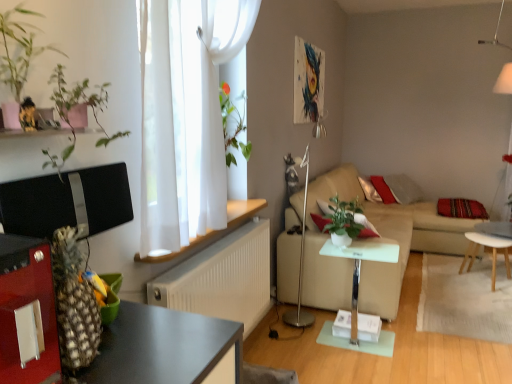
Question: Should I look upward or downward to see light wood/wooden stool at lower right, the second table when ordered from front to back?

Choices:
 (A) down
 (B) up

Answer: (A)

Question: Are white textured radiator at center and silver metallic floor lamp at center, positioned as the 1th lamp in left-to-right order, beside each other?

Choices:
 (A) no
 (B) yes

Answer: (A)

Question: Is white textured radiator at center positioned in front of silver metallic floor lamp at center, positioned as the 1th lamp in left-to-right order?

Choices:
 (A) no
 (B) yes

Answer: (B)

Question: Can you confirm if white textured radiator at center is smaller than silver metallic floor lamp at center, the first lamp when ordered from bottom to top?

Choices:
 (A) no
 (B) yes

Answer: (B)

Question: Is white textured radiator at center outside silver metallic floor lamp at center, the second lamp viewed from the right?

Choices:
 (A) no
 (B) yes

Answer: (B)

Question: From a real-world perspective, is white textured radiator at center located beneath silver metallic floor lamp at center, positioned as the 1th lamp in left-to-right order?

Choices:
 (A) no
 (B) yes

Answer: (B)

Question: Considering the relative sizes of white textured radiator at center and silver metallic floor lamp at center, positioned as the 1th lamp in left-to-right order, in the image provided, is white textured radiator at center thinner than silver metallic floor lamp at center, positioned as the 1th lamp in left-to-right order,?

Choices:
 (A) yes
 (B) no

Answer: (A)

Question: Considering the relative sizes of white glossy side table at center, which is the 2th table in back-to-front order, and silver metallic floor lamp at center, positioned as the second lamp in top-to-bottom order, in the image provided, is white glossy side table at center, which is the 2th table in back-to-front order, smaller than silver metallic floor lamp at center, positioned as the second lamp in top-to-bottom order,?

Choices:
 (A) no
 (B) yes

Answer: (B)

Question: Can you confirm if white glossy side table at center, which ranks as the first table in front-to-back order, is thinner than silver metallic floor lamp at center, the second lamp viewed from the right?

Choices:
 (A) yes
 (B) no

Answer: (B)

Question: From a real-world perspective, is white glossy side table at center, the 2th table in the right-to-left sequence, physically below silver metallic floor lamp at center, positioned as the 1th lamp in left-to-right order?

Choices:
 (A) yes
 (B) no

Answer: (A)

Question: Is white glossy side table at center, which ranks as the first table in front-to-back order, closer to the viewer compared to silver metallic floor lamp at center, the first lamp when ordered from bottom to top?

Choices:
 (A) yes
 (B) no

Answer: (A)

Question: Does white glossy side table at center, which is the 2th table in back-to-front order, have a lesser height compared to silver metallic floor lamp at center, positioned as the 1th lamp in left-to-right order?

Choices:
 (A) no
 (B) yes

Answer: (B)

Question: Is white glossy side table at center, which is the 2th table in back-to-front order, looking in the opposite direction of silver metallic floor lamp at center, the first lamp when ordered from bottom to top?

Choices:
 (A) no
 (B) yes

Answer: (B)

Question: From the image's perspective, is silver metallic floor lamp at center, the first lamp when ordered from bottom to top, above white textured radiator at center?

Choices:
 (A) no
 (B) yes

Answer: (B)